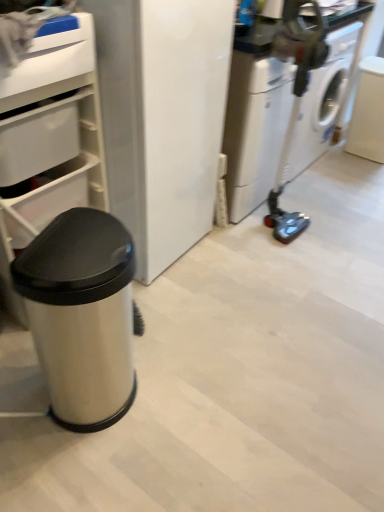
The height and width of the screenshot is (512, 384). What do you see at coordinates (322, 101) in the screenshot?
I see `white glossy washing machine at right` at bounding box center [322, 101].

This screenshot has width=384, height=512. What are the coordinates of `white plastic drawer at upper left, which is the first drawer from bottom to top` in the screenshot? It's located at (38, 142).

You are a GUI agent. You are given a task and a screenshot of the screen. Output one action in this format:
    pyautogui.click(x=<x>, y=<y>)
    Task: Click on the white glossy washing machine at right
    
    Given the screenshot: What is the action you would take?
    pyautogui.click(x=322, y=101)

Is point (107, 362) positioned before point (335, 123)?

Yes.

Which object is further away from the camera taking this photo, satin silver trash can at left or white glossy washing machine at right?

A: Positioned behind is white glossy washing machine at right.

There is a satin silver trash can at left. Where is `washing machine above it (from a real-world perspective)`? washing machine above it (from a real-world perspective) is located at coordinates (322, 101).

Can you tell me how much satin silver trash can at left and white glossy washing machine at right differ in facing direction?

The angle between the facing direction of satin silver trash can at left and the facing direction of white glossy washing machine at right is 1.1 degrees.

Relative to white plastic drawer at upper left, the second drawer from the bottom, is satin silver trash can at left in front or behind?

satin silver trash can at left is positioned closer to the viewer than white plastic drawer at upper left, the second drawer from the bottom.

From their relative heights in the image, would you say satin silver trash can at left is taller or shorter than white plastic drawer at upper left, positioned as the first drawer in top-to-bottom order?

In the image, satin silver trash can at left appears to be taller than white plastic drawer at upper left, positioned as the first drawer in top-to-bottom order.

From a real-world perspective, is satin silver trash can at left positioned under white plastic drawer at upper left, the second drawer from the bottom, based on gravity?

Indeed, from a real-world perspective, satin silver trash can at left is positioned beneath white plastic drawer at upper left, the second drawer from the bottom.

Is satin silver trash can at left turned away from white plastic drawer at upper left, positioned as the first drawer in top-to-bottom order?

No, satin silver trash can at left's orientation is not away from white plastic drawer at upper left, positioned as the first drawer in top-to-bottom order.

Do you think white plastic drawer at upper left, which is counted as the second drawer, starting from the top, is within satin silver trash can at left, or outside of it?

white plastic drawer at upper left, which is counted as the second drawer, starting from the top, is outside satin silver trash can at left.

Is white plastic drawer at upper left, which is the first drawer from bottom to top, turned away from satin silver trash can at left?

That's not correct — white plastic drawer at upper left, which is the first drawer from bottom to top, is not looking away from satin silver trash can at left.

Which object is thinner, white plastic drawer at upper left, which is the first drawer from bottom to top, or satin silver trash can at left?

With smaller width is white plastic drawer at upper left, which is the first drawer from bottom to top.

Identify the location of drawer that is the 2nd one when counting backward from the satin silver trash can at left. (38, 142).

Is point (101, 224) in front of point (4, 133)?

Yes.

In the scene shown: Would you say satin silver trash can at left is outside white plastic drawer at upper left, which is counted as the second drawer, starting from the top?

satin silver trash can at left lies outside white plastic drawer at upper left, which is counted as the second drawer, starting from the top,'s area.

Is satin silver trash can at left positioned with its back to white plastic drawer at upper left, which is counted as the second drawer, starting from the top?

Yes, white plastic drawer at upper left, which is counted as the second drawer, starting from the top, is at the back of satin silver trash can at left.

Is point (47, 63) closer to camera compared to point (34, 266)?

No.

From a real-world perspective, is white plastic drawer at upper left, the second drawer from the bottom, over satin silver trash can at left?

Yes.

In the image, is white plastic drawer at upper left, the second drawer from the bottom, on the left side or the right side of satin silver trash can at left?

Based on their positions, white plastic drawer at upper left, the second drawer from the bottom, is located to the left of satin silver trash can at left.

From the image's perspective, which one is positioned higher, white plastic drawer at upper left, positioned as the first drawer in top-to-bottom order, or satin silver trash can at left?

white plastic drawer at upper left, positioned as the first drawer in top-to-bottom order.

Considering the positions of objects white glossy washing machine at right and satin silver trash can at left in the image provided, who is in front, white glossy washing machine at right or satin silver trash can at left?

satin silver trash can at left is in front.

Looking at this image, from the image's perspective, which is below, white glossy washing machine at right or satin silver trash can at left?

satin silver trash can at left appears lower in the image.

Is white glossy washing machine at right with satin silver trash can at left?

No, white glossy washing machine at right is not in contact with satin silver trash can at left.

What's the angular difference between white plastic drawer at upper left, which is the first drawer from bottom to top, and white glossy washing machine at right's facing directions?

white plastic drawer at upper left, which is the first drawer from bottom to top, and white glossy washing machine at right are facing 1.1 degrees away from each other.

From a real-world perspective, who is located higher, white plastic drawer at upper left, which is counted as the second drawer, starting from the top, or white glossy washing machine at right?

white plastic drawer at upper left, which is counted as the second drawer, starting from the top, from a real-world perspective.

Is white plastic drawer at upper left, which is counted as the second drawer, starting from the top, aimed at white glossy washing machine at right?

No.

Where is `washing machine above the satin silver trash can at left (from the image's perspective)`? The height and width of the screenshot is (512, 384). washing machine above the satin silver trash can at left (from the image's perspective) is located at coordinates coord(322,101).

At what (x,y) coordinates should I click in order to perform the action: click on the 1st drawer behind when counting from the satin silver trash can at left. Please return your answer as a coordinate pair (x, y). This screenshot has width=384, height=512. Looking at the image, I should click on (52, 55).

Considering their positions, is white plastic drawer at upper left, which is counted as the second drawer, starting from the top, positioned closer to satin silver trash can at left than white plastic drawer at upper left, positioned as the first drawer in top-to-bottom order?

white plastic drawer at upper left, which is counted as the second drawer, starting from the top, is positioned closer to the anchor satin silver trash can at left.

When comparing their distances from white glossy washing machine at right, does white plastic drawer at upper left, positioned as the first drawer in top-to-bottom order, or white plastic drawer at upper left, which is the first drawer from bottom to top, seem closer?

white plastic drawer at upper left, which is the first drawer from bottom to top, is positioned closer to the anchor white glossy washing machine at right.

Considering their positions, is white glossy washing machine at right positioned closer to white plastic drawer at upper left, positioned as the first drawer in top-to-bottom order, than white plastic drawer at upper left, which is counted as the second drawer, starting from the top?

Based on the image, white plastic drawer at upper left, which is counted as the second drawer, starting from the top, appears to be nearer to white plastic drawer at upper left, positioned as the first drawer in top-to-bottom order.

Based on their spatial positions, is white glossy washing machine at right or white plastic drawer at upper left, positioned as the first drawer in top-to-bottom order, further from white plastic drawer at upper left, which is counted as the second drawer, starting from the top?

Among the two, white glossy washing machine at right is located further to white plastic drawer at upper left, which is counted as the second drawer, starting from the top.

When comparing their distances from satin silver trash can at left, does white glossy washing machine at right or white plastic drawer at upper left, positioned as the first drawer in top-to-bottom order, seem further?

white glossy washing machine at right is positioned further to the anchor satin silver trash can at left.

Looking at the image, which one is located further to white glossy washing machine at right, satin silver trash can at left or white plastic drawer at upper left, the second drawer from the bottom?

satin silver trash can at left is positioned further to the anchor white glossy washing machine at right.

Considering their positions, is satin silver trash can at left positioned closer to white plastic drawer at upper left, which is the first drawer from bottom to top, than white glossy washing machine at right?

satin silver trash can at left is positioned closer to the anchor white plastic drawer at upper left, which is the first drawer from bottom to top.

Based on their spatial positions, is white plastic drawer at upper left, positioned as the first drawer in top-to-bottom order, or satin silver trash can at left further from white plastic drawer at upper left, which is the first drawer from bottom to top?

Among the two, satin silver trash can at left is located further to white plastic drawer at upper left, which is the first drawer from bottom to top.

This screenshot has height=512, width=384. What are the coordinates of `waste container between white plastic drawer at upper left, which is counted as the second drawer, starting from the top, and white glossy washing machine at right, in the horizontal direction` in the screenshot? It's located at (81, 315).

Find the location of a particular element. The height and width of the screenshot is (512, 384). drawer between white plastic drawer at upper left, the second drawer from the bottom, and satin silver trash can at left, in the vertical direction is located at coordinates (38, 142).

Find the location of a particular element. This screenshot has height=512, width=384. drawer situated between white plastic drawer at upper left, which is the first drawer from bottom to top, and white glossy washing machine at right from left to right is located at coordinates (52, 55).